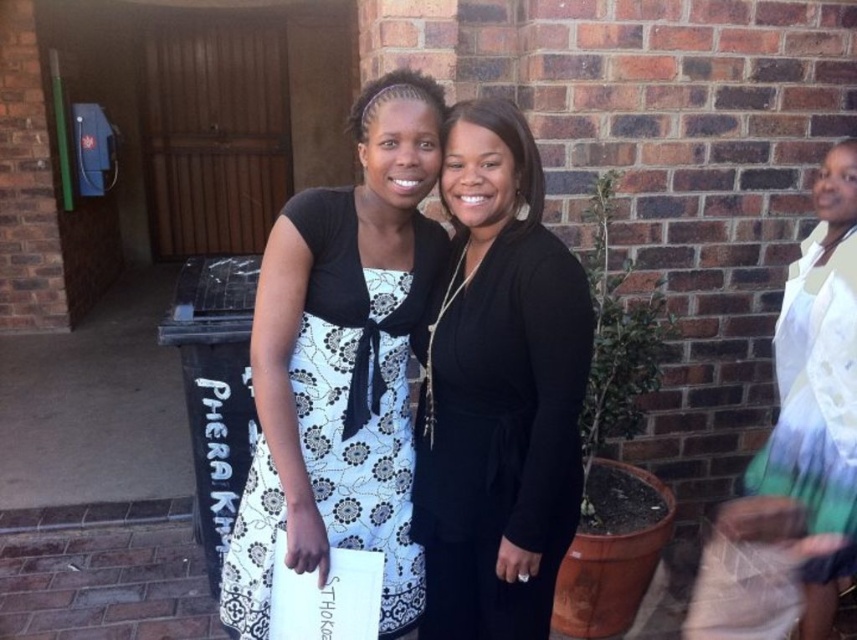
Question: Is black matte dress at center smaller than white floral dress at center?

Choices:
 (A) yes
 (B) no

Answer: (A)

Question: Which point appears farthest from the camera in this image?

Choices:
 (A) (580, 289)
 (B) (835, 253)

Answer: (B)

Question: Does black matte dress at center have a lesser width compared to white textured dress at right?

Choices:
 (A) yes
 (B) no

Answer: (B)

Question: Which of the following is the closest to the observer?

Choices:
 (A) (x=489, y=180)
 (B) (x=850, y=401)

Answer: (A)

Question: Which is farther from the black matte dress at center?

Choices:
 (A) white floral dress at center
 (B) white textured dress at right

Answer: (B)

Question: Does black matte dress at center lie behind white textured dress at right?

Choices:
 (A) yes
 (B) no

Answer: (B)